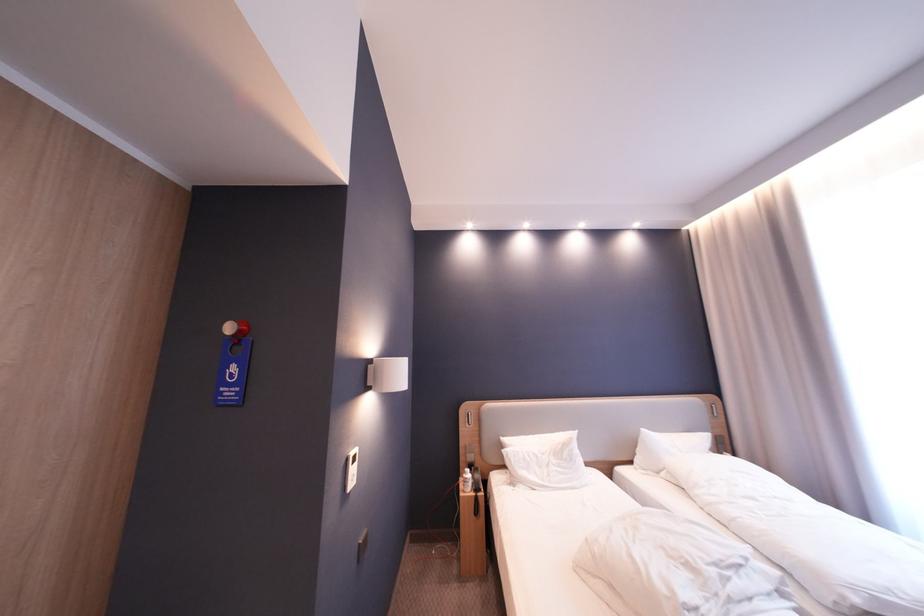
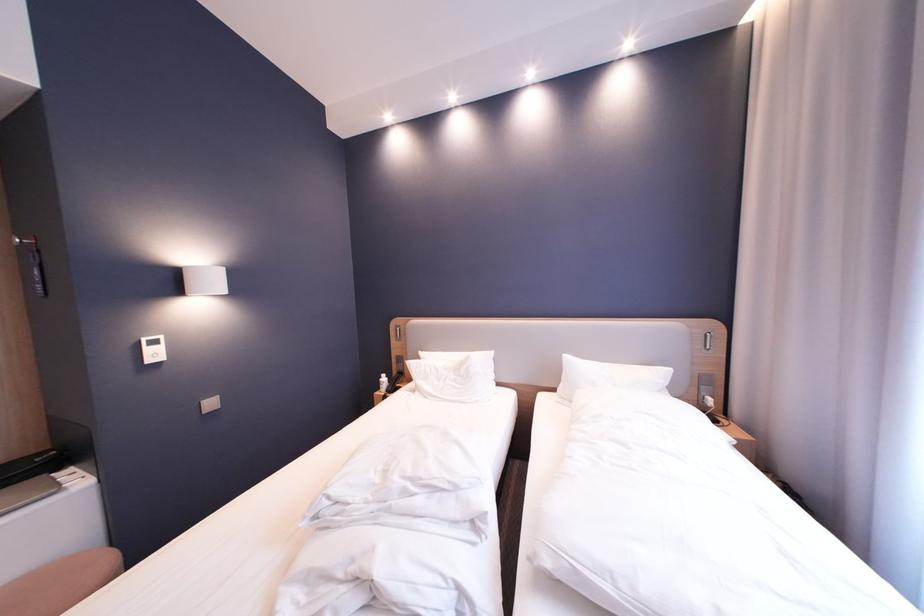
Question: The images are taken continuously from a first-person perspective. In which direction are you moving?

Choices:
 (A) Left
 (B) Right
 (C) Forward
 (D) Backward

Answer: (B)